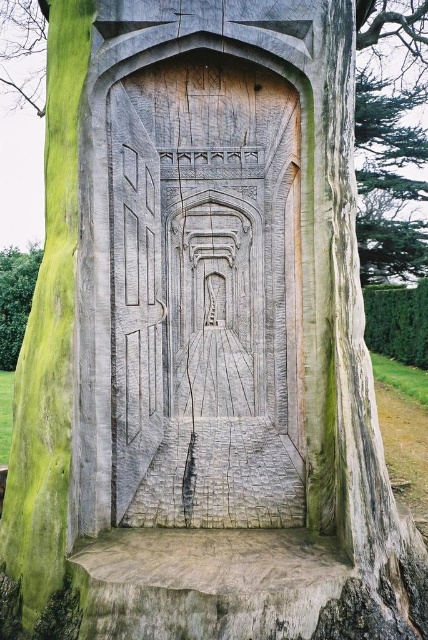
Question: From the image, what is the correct spatial relationship of carved wood door at center in relation to green wood tree at left?

Choices:
 (A) left
 (B) right

Answer: (B)

Question: Can you confirm if carved wood door at center is smaller than green wood tree at left?

Choices:
 (A) no
 (B) yes

Answer: (B)

Question: Which point is farther to the camera?

Choices:
 (A) (23, 266)
 (B) (297, 301)

Answer: (A)

Question: Which point is farther to the camera?

Choices:
 (A) green wood tree at left
 (B) carved wood door at center

Answer: (A)

Question: Is carved wood door at center to the right of green wood tree at left from the viewer's perspective?

Choices:
 (A) yes
 (B) no

Answer: (A)